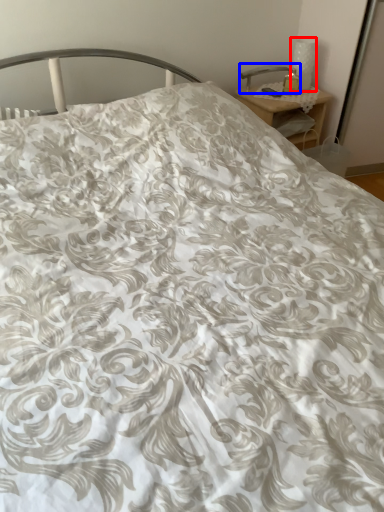
Question: Which object appears closest to the camera in this image, table lamp (highlighted by a red box) or table lamp (highlighted by a blue box)?

Choices:
 (A) table lamp
 (B) table lamp

Answer: (A)